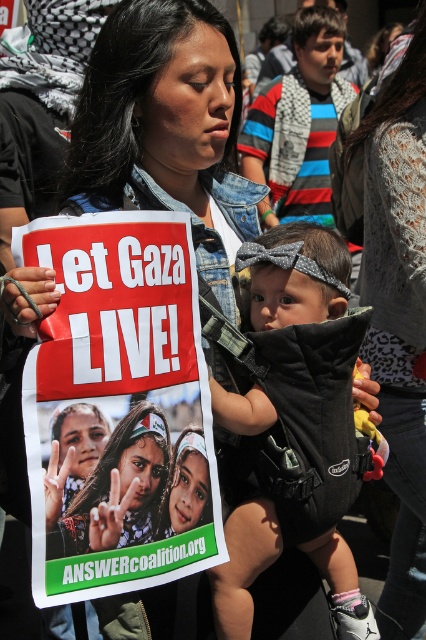
Does white paper poster at center appear under black fabric baby carrier at center?

Yes, white paper poster at center is below black fabric baby carrier at center.

Find the location of a particular element. The image size is (426, 640). white paper poster at center is located at coordinates (118, 406).